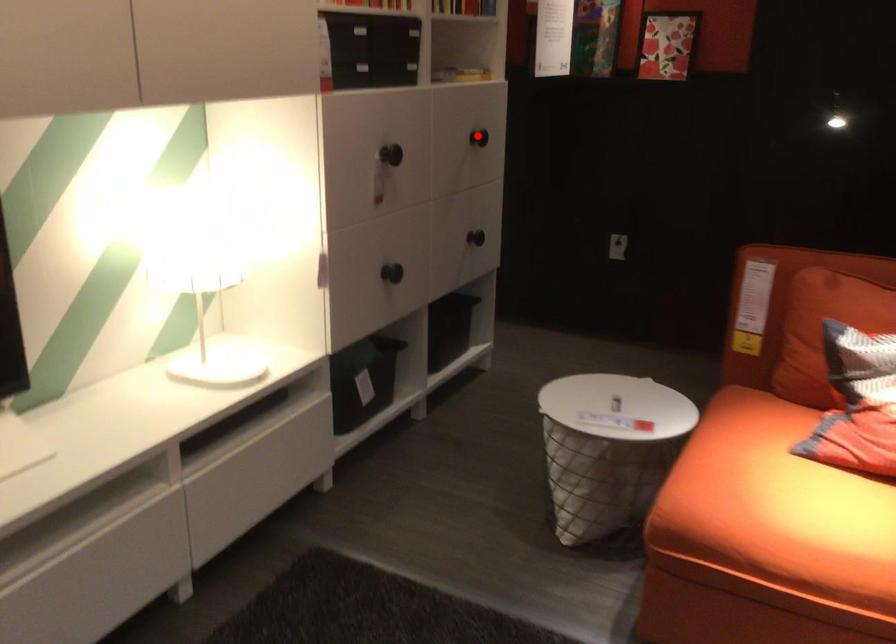
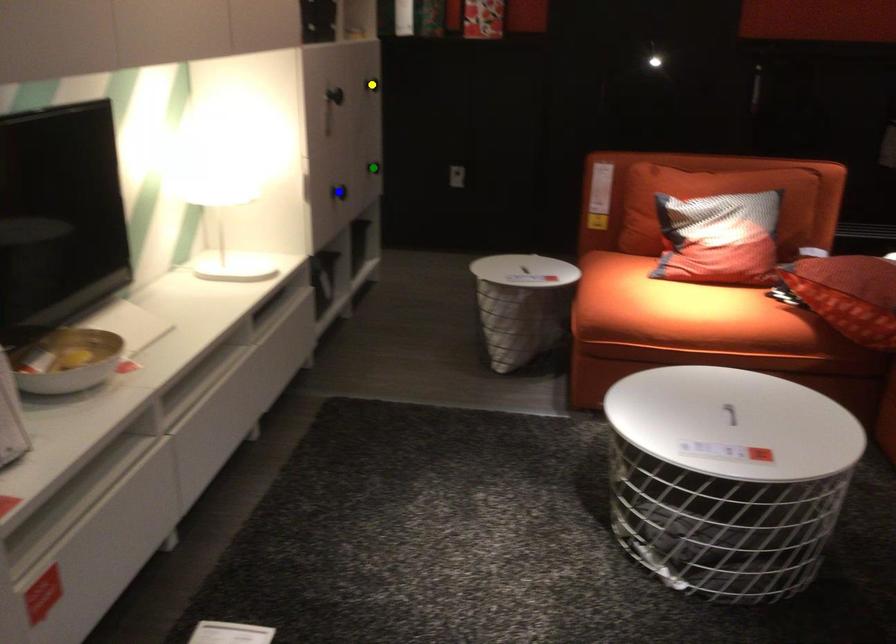
Question: I am providing you with two images of the same scene from different viewpoints. A red point is marked on the first image. You are given multiple points on the second image. Can you choose the point in image 2 that corresponds to the point in image 1?

Choices:
 (A) green point
 (B) blue point
 (C) yellow point

Answer: (C)